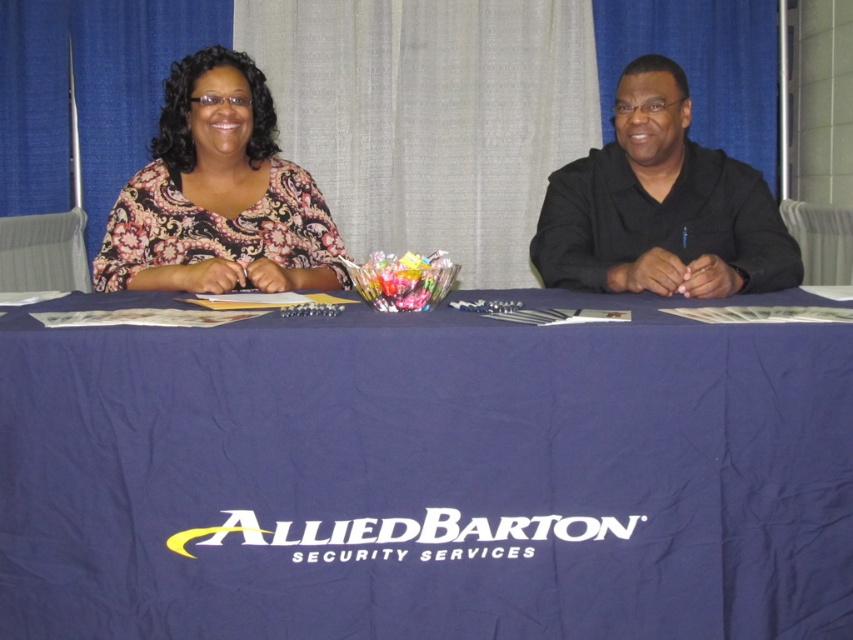
Question: From the image, what is the correct spatial relationship of paisley-patterned blouse at upper left in relation to black matte shirt at right?

Choices:
 (A) left
 (B) right

Answer: (A)

Question: Which of the following is the farthest from the observer?

Choices:
 (A) black matte shirt at right
 (B) navy blue fabric at center
 (C) paisley-patterned blouse at upper left

Answer: (C)

Question: Can you confirm if paisley-patterned blouse at upper left is positioned to the left of black matte shirt at right?

Choices:
 (A) no
 (B) yes

Answer: (B)

Question: Which of the following is the closest to the observer?

Choices:
 (A) (267, 634)
 (B) (268, 260)
 (C) (727, 221)

Answer: (A)

Question: Is navy blue fabric at center closer to camera compared to black matte shirt at right?

Choices:
 (A) yes
 (B) no

Answer: (A)

Question: Among these objects, which one is nearest to the camera?

Choices:
 (A) navy blue fabric at center
 (B) paisley-patterned blouse at upper left

Answer: (A)